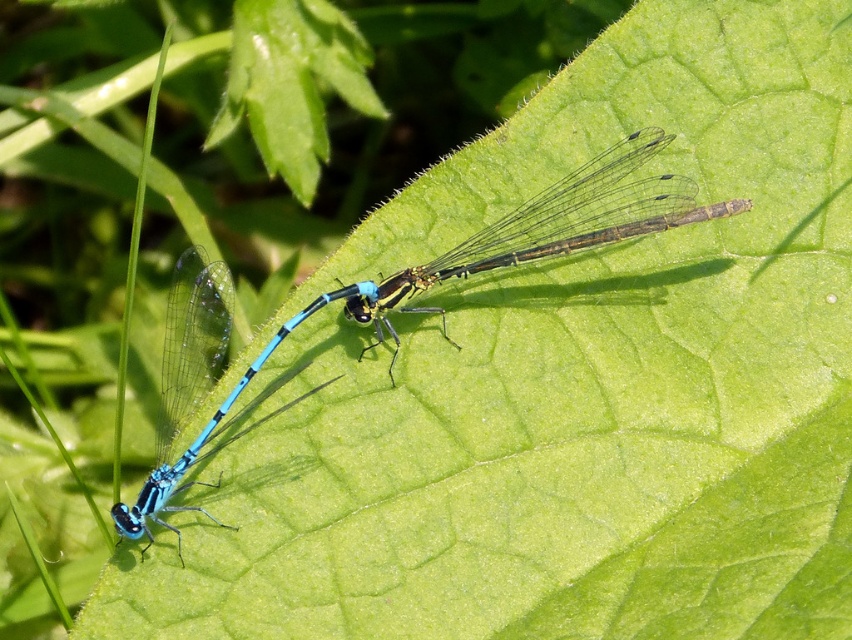
You are a nature photographer aiming to capture both the blue glossy dragonfly at center and the blue translucent wings at left in a single frame. Given that your camera can only focus on objects within a 10 cm width, will both fit in the frame if you adjust the focus to accommodate the larger object?

The blue glossy dragonfly at center is larger in width than the blue translucent wings at left. Since the camera can focus on objects within a 10 cm width, if the dragonfly at center is within that limit, both can fit. However, if the dragonfly exceeds 10 cm, only the wings might fit. The answer depends on the dragonflys actual size.

You are a researcher studying dragonflies and their resting positions. You notice a point marked at coordinates (x=415, y=292) on the image. Which dragonfly is this point located on?

The point at coordinates (x=415, y=292) is located on the blue glossy dragonfly at center.